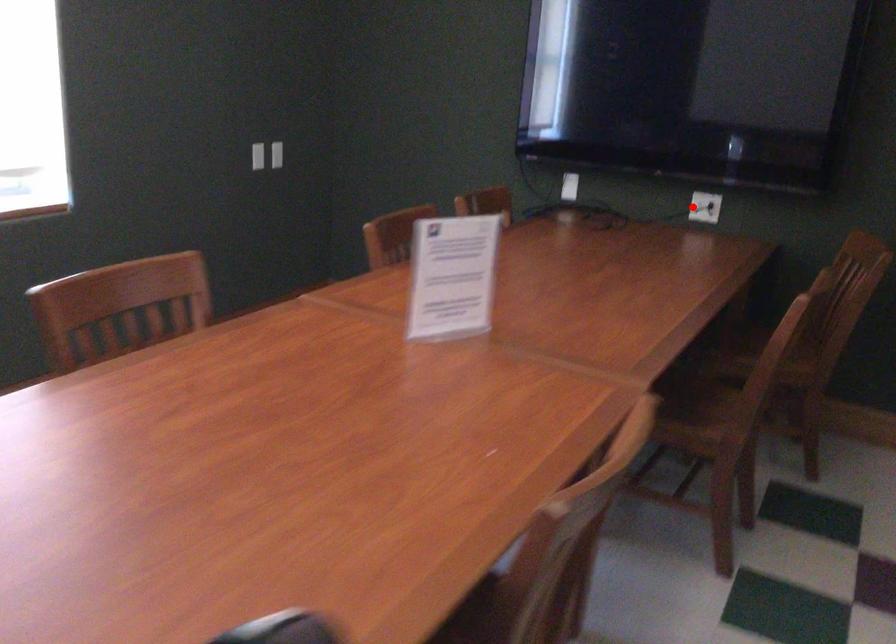
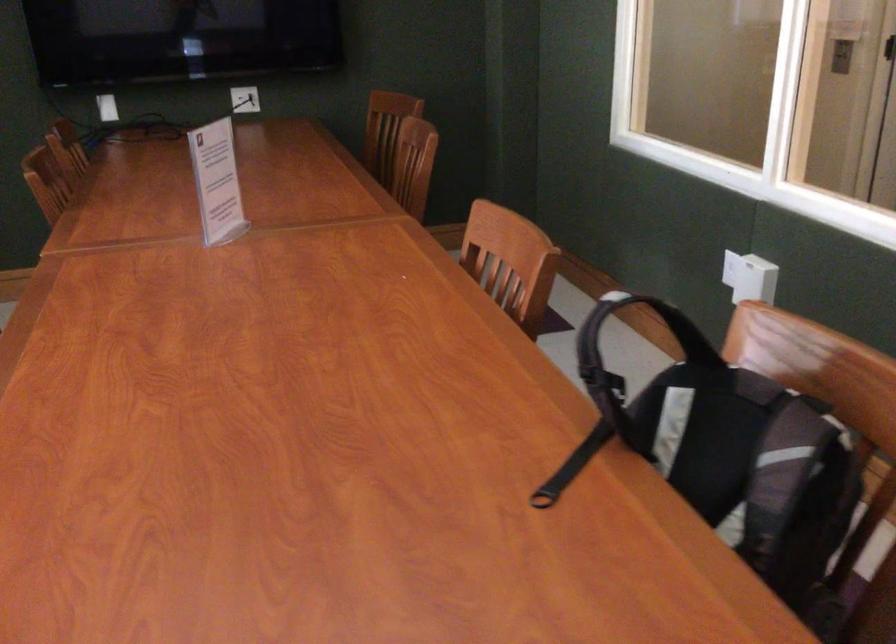
Locate, in the second image, the point that corresponds to the highlighted location in the first image.

(245, 99)